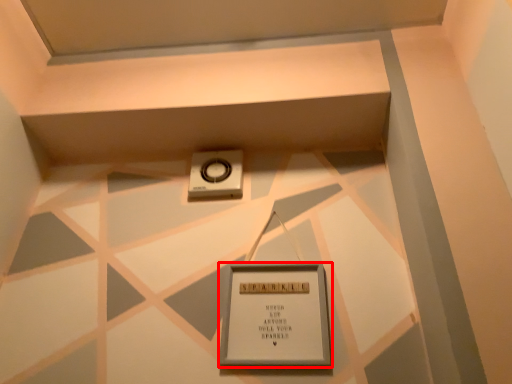
Question: From the image's perspective, where is picture frame (annotated by the red box) located relative to weight scale?

Choices:
 (A) below
 (B) above

Answer: (A)